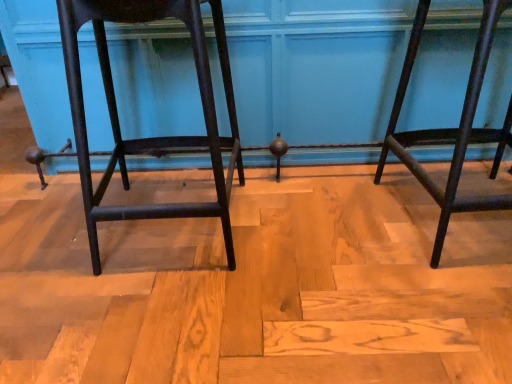
Question: Is matte black stool at right, positioned as the second furniture in left-to-right order, not inside matte black stool at left, positioned as the 2th furniture in right-to-left order?

Choices:
 (A) no
 (B) yes

Answer: (B)

Question: Is matte black stool at right, positioned as the second furniture in left-to-right order, shorter than matte black stool at left, positioned as the 2th furniture in right-to-left order?

Choices:
 (A) yes
 (B) no

Answer: (A)

Question: From a real-world perspective, does matte black stool at right, positioned as the second furniture in left-to-right order, sit lower than matte black stool at left, positioned as the 2th furniture in right-to-left order?

Choices:
 (A) no
 (B) yes

Answer: (B)

Question: Is matte black stool at left, positioned as the 2th furniture in right-to-left order, a part of matte black stool at right, positioned as the second furniture in left-to-right order?

Choices:
 (A) no
 (B) yes

Answer: (A)

Question: Is matte black stool at right, the 1th furniture from the right, closer to the viewer compared to matte black stool at left, which is the first furniture from left to right?

Choices:
 (A) no
 (B) yes

Answer: (A)

Question: Considering the relative sizes of matte black stool at right, positioned as the second furniture in left-to-right order, and matte black stool at left, which is the first furniture from left to right, in the image provided, is matte black stool at right, positioned as the second furniture in left-to-right order, thinner than matte black stool at left, which is the first furniture from left to right,?

Choices:
 (A) yes
 (B) no

Answer: (B)

Question: Does matte black stool at left, positioned as the 2th furniture in right-to-left order, have a greater height compared to matte black stool at right, the 1th furniture from the right?

Choices:
 (A) no
 (B) yes

Answer: (B)

Question: Is matte black stool at left, which is the first furniture from left to right, oriented towards matte black stool at right, the 1th furniture from the right?

Choices:
 (A) no
 (B) yes

Answer: (A)

Question: From the image's perspective, is matte black stool at left, which is the first furniture from left to right, beneath matte black stool at right, the 1th furniture from the right?

Choices:
 (A) no
 (B) yes

Answer: (B)

Question: Is matte black stool at left, positioned as the 2th furniture in right-to-left order, to the left of matte black stool at right, positioned as the second furniture in left-to-right order, from the viewer's perspective?

Choices:
 (A) no
 (B) yes

Answer: (B)

Question: Is matte black stool at left, positioned as the 2th furniture in right-to-left order, far from matte black stool at right, positioned as the second furniture in left-to-right order?

Choices:
 (A) no
 (B) yes

Answer: (A)

Question: Is matte black stool at left, which is the first furniture from left to right, smaller than matte black stool at right, positioned as the second furniture in left-to-right order?

Choices:
 (A) no
 (B) yes

Answer: (B)

Question: Is matte black stool at left, positioned as the 2th furniture in right-to-left order, spatially inside matte black stool at right, positioned as the second furniture in left-to-right order, or outside of it?

Choices:
 (A) outside
 (B) inside

Answer: (A)